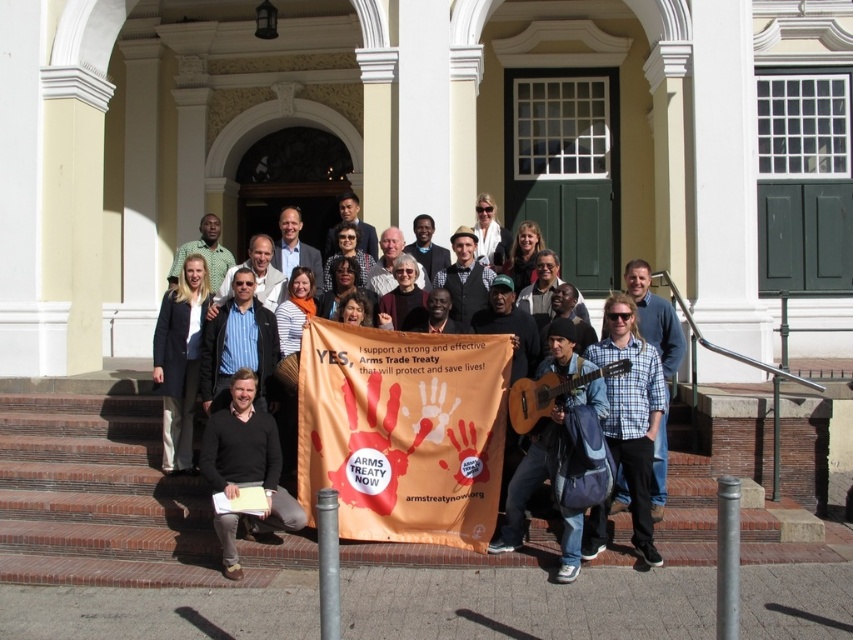
Question: Considering the real-world distances, which object is farthest from the matte white shirt at center?

Choices:
 (A) black sweater at center
 (B) matte black guitar at center

Answer: (A)

Question: Can you confirm if orange fabric banner at center is positioned to the left of matte black shirt at center?

Choices:
 (A) yes
 (B) no

Answer: (B)

Question: Which object is the closest to the brick stairs at lower left?

Choices:
 (A) black sweater at center
 (B) matte black shirt at center
 (C) matte black guitar at center
 (D) matte white shirt at center

Answer: (A)

Question: Which of these objects is positioned closest to the orange fabric banner at center?

Choices:
 (A) brick stairs at lower left
 (B) matte black guitar at center
 (C) matte black shirt at center

Answer: (A)

Question: Observing the image, what is the correct spatial positioning of matte black guitar at center in reference to black sweater at center?

Choices:
 (A) above
 (B) below

Answer: (A)

Question: In this image, where is brick stairs at lower left located relative to matte black guitar at center?

Choices:
 (A) above
 (B) below

Answer: (B)